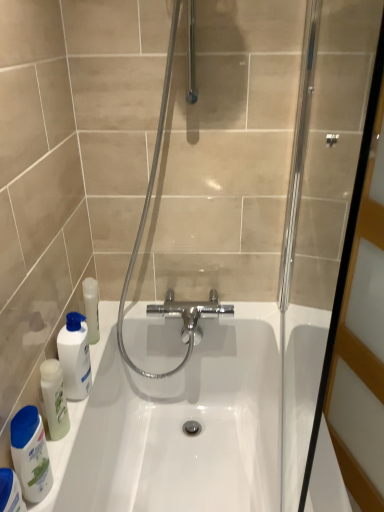
Question: Is white glossy bathtub at lower left spatially inside translucent plastic bottle at lower left, which appears as the first cleaning product when viewed from the front, or outside of it?

Choices:
 (A) inside
 (B) outside

Answer: (B)

Question: Is white glossy bathtub at lower left taller or shorter than translucent plastic bottle at lower left, which appears as the first cleaning product when viewed from the front?

Choices:
 (A) short
 (B) tall

Answer: (B)

Question: Estimate the real-world distances between objects in this image. Which object is farther from the clear glass screen door at right?

Choices:
 (A) white glossy mouthwash at left
 (B) translucent plastic bottle at lower left, which appears as the first cleaning product when viewed from the front
 (C) white glossy bottle at lower left, positioned as the 2th cleaning product in front-to-back order
 (D) translucent plastic bottle at lower left, the 3th cleaning product in the front-to-back sequence
 (E) white glossy bathtub at lower left

Answer: (B)

Question: Based on their relative distances, which object is farther from the translucent plastic bottle at lower left, which appears as the first cleaning product when viewed from the front?

Choices:
 (A) white glossy bottle at lower left, positioned as the 2th cleaning product in front-to-back order
 (B) white glossy bathtub at lower left
 (C) white glossy mouthwash at left
 (D) translucent plastic bottle at lower left, the 3th cleaning product in the front-to-back sequence
 (E) clear glass screen door at right

Answer: (E)